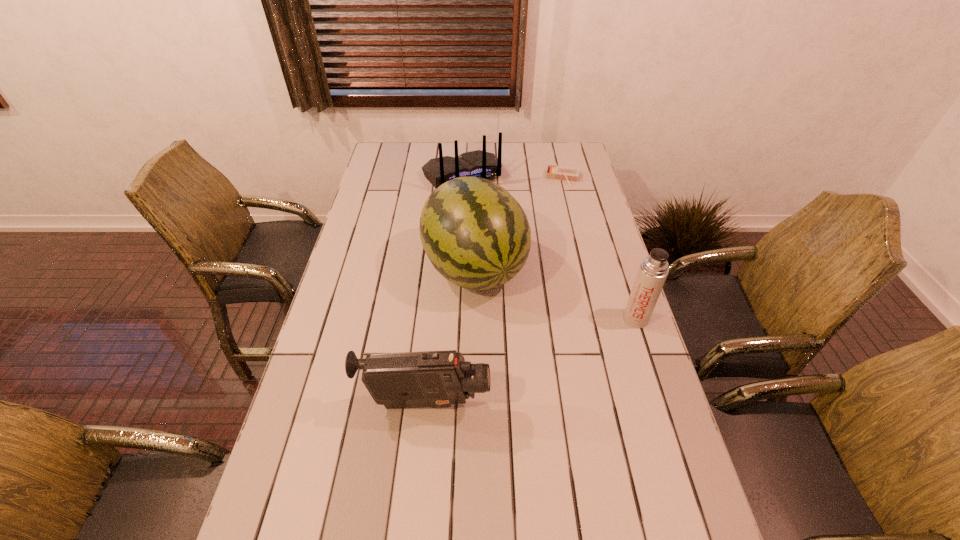
Identify the location of object situated at the left edge. The height and width of the screenshot is (540, 960). (437, 379).

Find the location of a particular element. The width and height of the screenshot is (960, 540). thermos bottle positioned at the right edge is located at coordinates (653, 271).

Locate an element on the screen. matchbox present at the right edge is located at coordinates (568, 174).

The image size is (960, 540). Find the location of `object positioned at the far right corner`. object positioned at the far right corner is located at coordinates (568, 174).

Where is `free space at the far edge of the desktop`? free space at the far edge of the desktop is located at coordinates (497, 142).

Where is `free space at the left edge of the desktop`? This screenshot has width=960, height=540. free space at the left edge of the desktop is located at coordinates (332, 403).

This screenshot has height=540, width=960. I want to click on free space at the right edge of the desktop, so click(640, 461).

At what (x,y) coordinates should I click in order to perform the action: click on free space between the fourth shortest object and the nearest object. Please return your answer as a coordinate pair (x, y). This screenshot has width=960, height=540. Looking at the image, I should click on (531, 361).

What are the coordinates of `free space between the router and the matchbox` in the screenshot? It's located at (513, 177).

Locate an element on the screen. Image resolution: width=960 pixels, height=540 pixels. free space between the matchbox and the router is located at coordinates (513, 177).